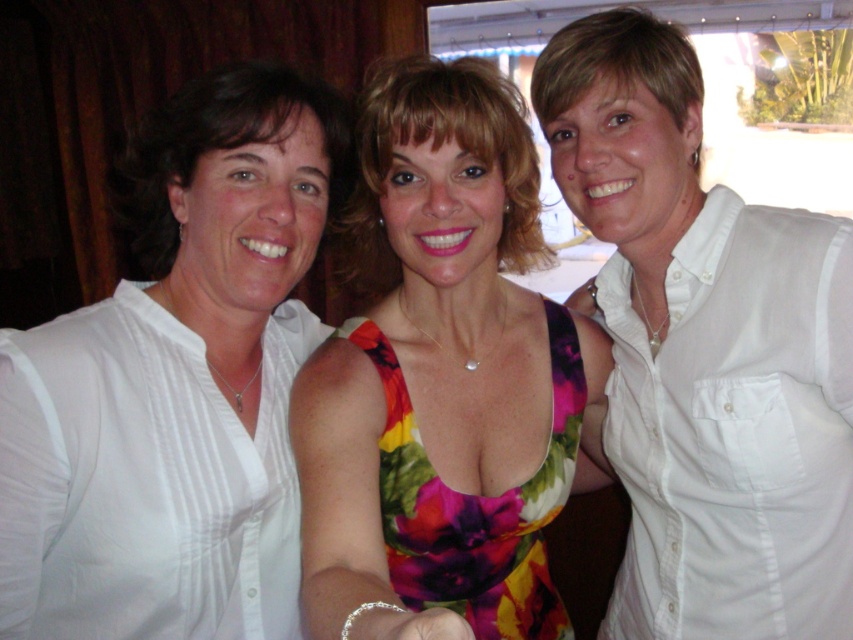
Between white cotton shirt at right and floral dress at center, which one has less height?

Standing shorter between the two is floral dress at center.

Measure the distance between point [550,109] and camera.

Point [550,109] and camera are 37.83 inches apart.

From the picture: Measure the distance between point (x=755, y=621) and camera.

A distance of 95.71 centimeters exists between point (x=755, y=621) and camera.

Identify the location of white cotton shirt at right. The image size is (853, 640). (705, 352).

Can you confirm if white satin blouse at left is shorter than floral dress at center?

Indeed, white satin blouse at left has a lesser height compared to floral dress at center.

Can you confirm if white satin blouse at left is wider than floral dress at center?

In fact, white satin blouse at left might be narrower than floral dress at center.

Which is in front, point (119, 609) or point (334, 528)?

Positioned in front is point (334, 528).

Find the location of a particular element. This screenshot has height=640, width=853. white satin blouse at left is located at coordinates (177, 385).

Can you confirm if white satin blouse at left is shorter than white cotton shirt at right?

Indeed, white satin blouse at left has a lesser height compared to white cotton shirt at right.

Can you confirm if white satin blouse at left is positioned below white cotton shirt at right?

No.

Who is more forward, (x=102, y=557) or (x=704, y=282)?

Point (x=102, y=557) is in front.

Find the location of a particular element. The width and height of the screenshot is (853, 640). white satin blouse at left is located at coordinates (177, 385).